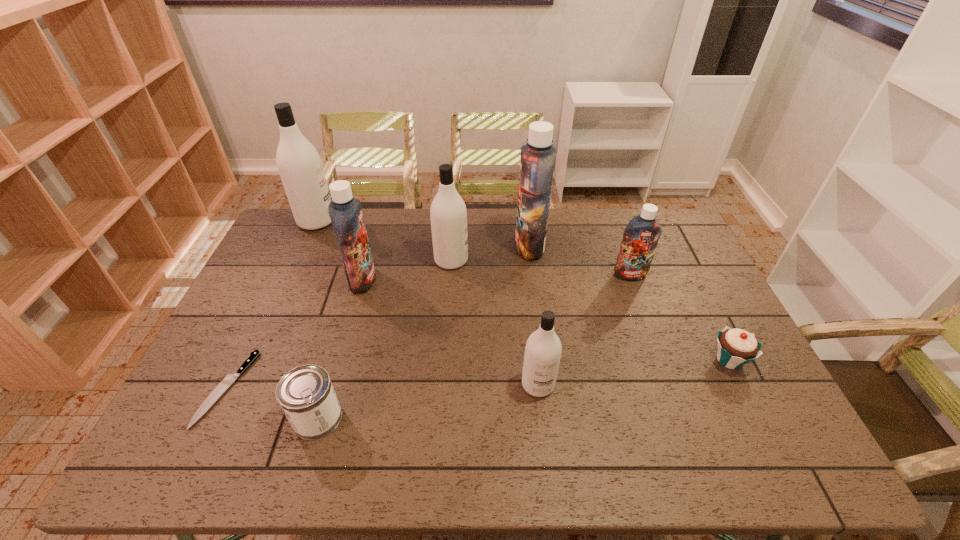
Identify which shampoo is the fourth nearest to the smallest blue shampoo. Please provide its 2D coordinates. Your answer should be formatted as a tuple, i.e. [(x, y)], where the tuple contains the x and y coordinates of a point satisfying the conditions above.

[(345, 211)]

Where is `the closest white shampoo to the rightmost blue shampoo`? the closest white shampoo to the rightmost blue shampoo is located at coordinates (543, 349).

Where is `white shampoo that is the third closest to the third shortest object`? This screenshot has width=960, height=540. white shampoo that is the third closest to the third shortest object is located at coordinates (299, 164).

You are a GUI agent. You are given a task and a screenshot of the screen. Output one action in this format:
    pyautogui.click(x=<x>, y=<y>)
    Task: Click on the blue shampoo that can be found as the closest to the second white shampoo from right to left
    The height and width of the screenshot is (540, 960).
    Given the screenshot: What is the action you would take?
    pyautogui.click(x=537, y=163)

Identify which blue shampoo is the second nearest to the biggest blue shampoo. Please provide its 2D coordinates. Your answer should be formatted as a tuple, i.e. [(x, y)], where the tuple contains the x and y coordinates of a point satisfying the conditions above.

[(345, 211)]

Identify the location of free point that satisfies the following two spatial constraints: 1. on the front label of the smallest blue shampoo; 2. on the front label of the leftmost blue shampoo. (632, 280).

The width and height of the screenshot is (960, 540). In order to click on vacant point that satisfies the following two spatial constraints: 1. on the front-facing side of the leftmost white shampoo; 2. on the back side of the rightmost object in this screenshot , I will do `click(252, 360)`.

Identify the location of free space that satisfies the following two spatial constraints: 1. on the front label of the biggest blue shampoo; 2. on the front side of the steak knife. (548, 389).